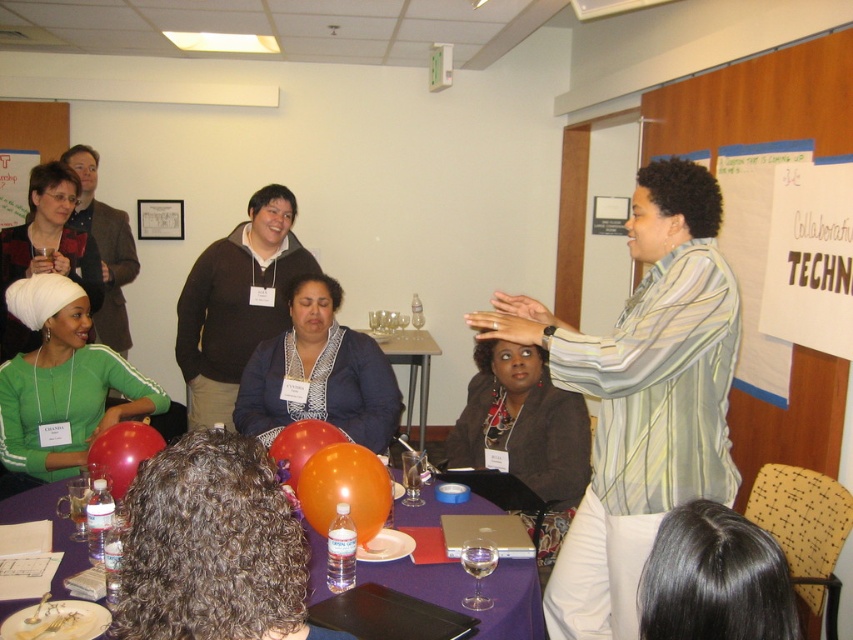
Question: Is matte green shirt at lower left smaller than rubber orange balloon at center?

Choices:
 (A) yes
 (B) no

Answer: (B)

Question: Which of the following is the closest to the observer?

Choices:
 (A) (248, 276)
 (B) (421, 385)
 (C) (337, 433)

Answer: (C)

Question: Among these points, which one is nearest to the camera?

Choices:
 (A) (332, 472)
 (B) (117, 381)
 (C) (474, 440)
 (D) (392, 348)

Answer: (A)

Question: Based on their relative distances, which object is farther from the green matte t-shirt at lower left?

Choices:
 (A) matte black jacket at center
 (B) black silky hair at center
 (C) curly brown hair at lower center
 (D) orange balloon at center

Answer: (D)

Question: Does brown sweater at center come in front of matte green shirt at lower left?

Choices:
 (A) no
 (B) yes

Answer: (A)

Question: Does striped cotton shirt at center appear on the left side of matte green shirt at lower left?

Choices:
 (A) yes
 (B) no

Answer: (B)